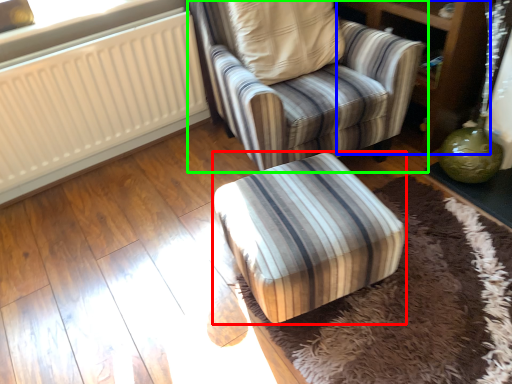
Question: Which object is positioned closest to furniture (highlighted by a red box)? Select from dresser (highlighted by a blue box) and chair (highlighted by a green box).

Choices:
 (A) dresser
 (B) chair

Answer: (B)